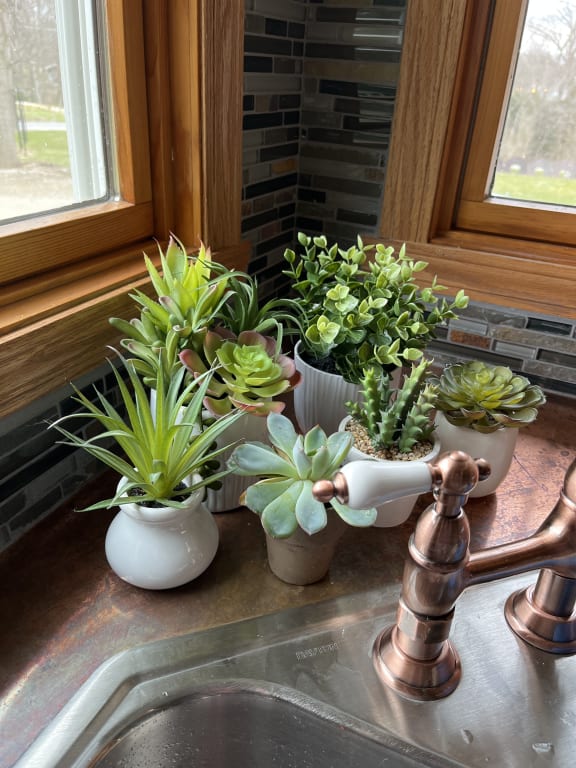
What are the coordinates of `stainless steel sink` in the screenshot? It's located at (487, 694).